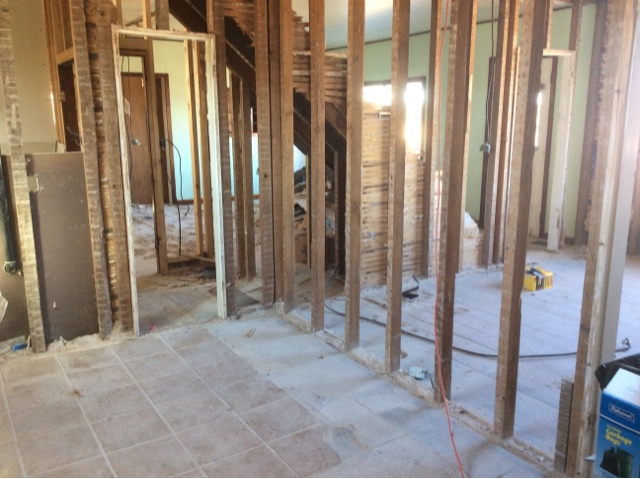
The height and width of the screenshot is (479, 640). I want to click on water pipe in wall, so click(x=11, y=259).